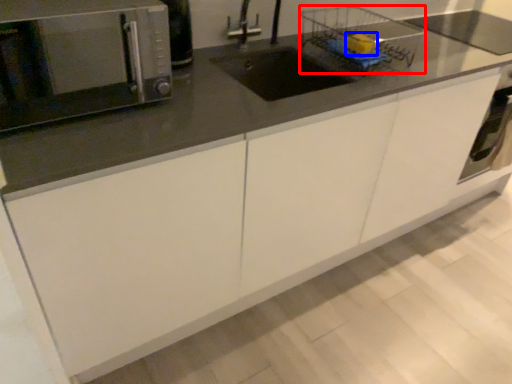
Question: Which point is further to the camera, basket (highlighted by a red box) or food (highlighted by a blue box)?

Choices:
 (A) basket
 (B) food

Answer: (B)